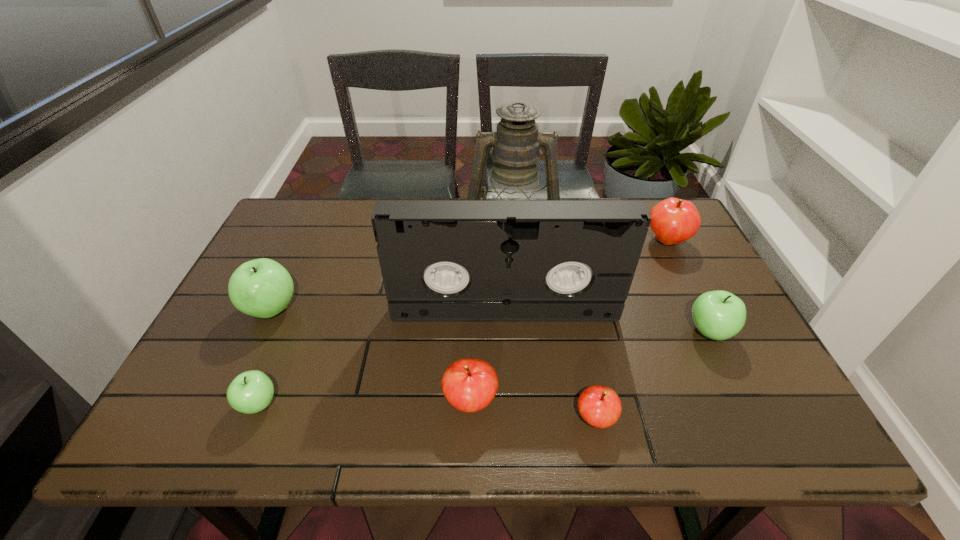
Locate an element on the screen. the second red apple from right to left is located at coordinates (600, 406).

You are a GUI agent. You are given a task and a screenshot of the screen. Output one action in this format:
    pyautogui.click(x=<x>, y=<y>)
    Task: Click on the smallest red apple
    
    Given the screenshot: What is the action you would take?
    pyautogui.click(x=600, y=406)

Identify the location of blank area located on the left of the oil lamp. (395, 237).

What are the coordinates of `free space located on the side of the gray videotape with visible spindles` in the screenshot? It's located at (507, 341).

Find the location of a particular element. vacant space located on the front of the biggest green apple is located at coordinates (253, 347).

Locate an element on the screen. The height and width of the screenshot is (540, 960). free space located on the front of the biggest red apple is located at coordinates (693, 293).

Identify the location of vacant space located on the left of the second biggest green apple. The width and height of the screenshot is (960, 540). (604, 331).

This screenshot has height=540, width=960. I want to click on vacant region located 0.150m on the left of the leftmost red apple, so click(372, 401).

Image resolution: width=960 pixels, height=540 pixels. Find the location of `vacant region located 0.120m on the left of the nearest green apple`. vacant region located 0.120m on the left of the nearest green apple is located at coordinates (180, 404).

Image resolution: width=960 pixels, height=540 pixels. In order to click on blank area located on the back of the smallest red apple in this screenshot , I will do `click(564, 272)`.